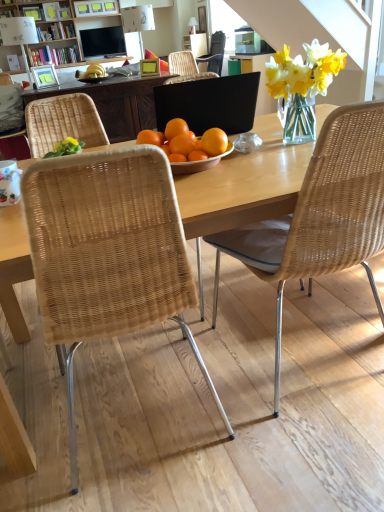
Image resolution: width=384 pixels, height=512 pixels. Identify the location of woven wicker chair at center, the 2th chair viewed from the back. (321, 214).

What do you see at coordinates (209, 103) in the screenshot?
I see `black matte laptop at center` at bounding box center [209, 103].

Locate an element on the screen. wooden table at center is located at coordinates (244, 185).

Image resolution: width=384 pixels, height=512 pixels. What do you see at coordinates (107, 252) in the screenshot?
I see `woven wicker chair at center, acting as the third chair starting from the back` at bounding box center [107, 252].

Measure the distance between point (x=16, y=106) and camera.

The distance of point (x=16, y=106) from camera is 4.02 meters.

Image resolution: width=384 pixels, height=512 pixels. Describe the element at coordinates (149, 67) in the screenshot. I see `matte green picture frame at upper center, positioned as the first picture frame in right-to-left order` at that location.

The height and width of the screenshot is (512, 384). I want to click on matte wood picture frame at upper left, which ranks as the second picture frame in right-to-left order, so click(x=44, y=76).

Considering the relative positions of wooden bookcase at upper center and woven wicker chair at center, the second chair positioned from the front, in the image provided, is wooden bookcase at upper center to the right of woven wicker chair at center, the second chair positioned from the front, from the viewer's perspective?

In fact, wooden bookcase at upper center is to the left of woven wicker chair at center, the second chair positioned from the front.

From the image's perspective, count 2nd chairs downward from the wooden bookcase at upper center and point to it. Please provide its 2D coordinates.

[(321, 214)]

Is point (83, 62) positioned before point (303, 251)?

No, (83, 62) is further to viewer.

Is woven wicker chair at center, positioned as the 2th chair in left-to-right order, at the back of black matte laptop at center?

black matte laptop at center does not have its back to woven wicker chair at center, positioned as the 2th chair in left-to-right order.

Considering the positions of objects black matte laptop at center and woven wicker chair at center, which ranks as the 2th chair in right-to-left order, in the image provided, who is more to the right, black matte laptop at center or woven wicker chair at center, which ranks as the 2th chair in right-to-left order,?

black matte laptop at center is more to the right.

Which of these two, black matte laptop at center or woven wicker chair at center, positioned as the 2th chair in left-to-right order, is bigger?

woven wicker chair at center, positioned as the 2th chair in left-to-right order.

Does point (211, 83) appear closer or farther from the camera than point (166, 215)?

Point (211, 83) is positioned farther from the camera compared to point (166, 215).

Consider the image. Is woven wicker chair at center, the second chair positioned from the front, oriented towards black matte laptop at center?

Yes, woven wicker chair at center, the second chair positioned from the front, is facing black matte laptop at center.

From their relative heights in the image, would you say woven wicker chair at center, arranged as the first chair when viewed from the right, is taller or shorter than black matte laptop at center?

Considering their sizes, woven wicker chair at center, arranged as the first chair when viewed from the right, has more height than black matte laptop at center.

Considering the sizes of objects woven wicker chair at center, the third chair from the left, and black matte laptop at center in the image provided, who is thinner, woven wicker chair at center, the third chair from the left, or black matte laptop at center?

With smaller width is black matte laptop at center.

Is black matte laptop at center touching wooden bookcase at upper center?

No, black matte laptop at center is not with wooden bookcase at upper center.

Who is taller, black matte laptop at center or wooden bookcase at upper center?

wooden bookcase at upper center is taller.

Is black matte laptop at center aimed at wooden bookcase at upper center?

Yes, black matte laptop at center is turned towards wooden bookcase at upper center.

Does black matte laptop at center have a lesser width compared to wooden bookcase at upper center?

Incorrect, the width of black matte laptop at center is not less than that of wooden bookcase at upper center.

Is black matte laptop at center inside or outside of wooden table at center?

black matte laptop at center is outside wooden table at center.

Does black matte laptop at center appear on the left side of wooden table at center?

Correct, you'll find black matte laptop at center to the left of wooden table at center.

This screenshot has width=384, height=512. I want to click on desk that appears in front of the black matte laptop at center, so click(x=244, y=185).

Considering the sizes of objects black matte laptop at center and wooden table at center in the image provided, who is taller, black matte laptop at center or wooden table at center?

Standing taller between the two is wooden table at center.

The height and width of the screenshot is (512, 384). Identify the location of chair that is the 3rd one when counting forward from the matte green picture frame at upper center, positioned as the first picture frame in right-to-left order. (107, 252).

Would you consider matte green picture frame at upper center, the 2th picture frame positioned from the left, to be distant from woven wicker chair at center, which ranks as the 2th chair in right-to-left order?

Yes, matte green picture frame at upper center, the 2th picture frame positioned from the left, is far from woven wicker chair at center, which ranks as the 2th chair in right-to-left order.

From a real-world perspective, is matte green picture frame at upper center, the 2th picture frame positioned from the left, located higher than woven wicker chair at center, which ranks as the 2th chair in right-to-left order?

Yes.

Between point (141, 68) and point (71, 332), which one is positioned behind?

The point (141, 68) is behind.

Considering the relative sizes of wooden bookcase at upper center and woven wicker chair at center, acting as the third chair starting from the back, in the image provided, is wooden bookcase at upper center shorter than woven wicker chair at center, acting as the third chair starting from the back,?

In fact, wooden bookcase at upper center may be taller than woven wicker chair at center, acting as the third chair starting from the back.

From the image's perspective, is wooden bookcase at upper center over woven wicker chair at center, which appears as the 1th chair when viewed from the front?

Yes, from the image's perspective, wooden bookcase at upper center is over woven wicker chair at center, which appears as the 1th chair when viewed from the front.

Between wooden bookcase at upper center and woven wicker chair at center, which ranks as the 2th chair in right-to-left order, which one has smaller size?

With smaller size is woven wicker chair at center, which ranks as the 2th chair in right-to-left order.

Based on their positions, is wooden bookcase at upper center located to the left or right of woven wicker chair at center, acting as the third chair starting from the back?

From the image, it's evident that wooden bookcase at upper center is to the left of woven wicker chair at center, acting as the third chair starting from the back.

Locate an element on the screen. This screenshot has width=384, height=512. bookcase positioned vertically above the woven wicker chair at center, the second chair positioned from the front (from a real-world perspective) is located at coordinates (54, 32).

Where is `chair that is the 3rd object directly below the black matte laptop at center (from a real-world perspective)`? The width and height of the screenshot is (384, 512). chair that is the 3rd object directly below the black matte laptop at center (from a real-world perspective) is located at coordinates (107, 252).

Estimate the real-world distances between objects in this image. Which object is further from woven wicker chair at center, the second chair positioned from the front, matte black television at upper center or wooden table at center?

matte black television at upper center is positioned further to the anchor woven wicker chair at center, the second chair positioned from the front.

Which object lies nearer to the anchor point woven wicker chair at center, positioned as the 2th chair in left-to-right order, matte green picture frame at upper center, the 2th picture frame positioned from the left, or wooden bookcase at upper center?

matte green picture frame at upper center, the 2th picture frame positioned from the left, is positioned closer to the anchor woven wicker chair at center, positioned as the 2th chair in left-to-right order.

When comparing their distances from matte wood picture frame at upper left, which is the first picture frame from left to right, does matte green picture frame at upper center, positioned as the first picture frame in right-to-left order, or wooden bookcase at upper center seem closer?

The object closer to matte wood picture frame at upper left, which is the first picture frame from left to right, is matte green picture frame at upper center, positioned as the first picture frame in right-to-left order.

From the image, which object appears to be farther from matte black television at upper center, woven rattan chair at left, the first chair when ordered from left to right, or matte green picture frame at upper center, the 2th picture frame positioned from the left?

woven rattan chair at left, the first chair when ordered from left to right, is positioned further to the anchor matte black television at upper center.

Considering their positions, is matte black television at upper center positioned closer to woven wicker chair at center, the second chair positioned from the front, than woven wicker chair at center, which ranks as the 2th chair in right-to-left order?

woven wicker chair at center, which ranks as the 2th chair in right-to-left order, lies closer to woven wicker chair at center, the second chair positioned from the front, than the other object.

When comparing their distances from matte wood picture frame at upper left, which is the first picture frame from left to right, does woven wicker chair at center, which appears as the 1th chair when viewed from the front, or wooden table at center seem further?

woven wicker chair at center, which appears as the 1th chair when viewed from the front, is positioned further to the anchor matte wood picture frame at upper left, which is the first picture frame from left to right.

Estimate the real-world distances between objects in this image. Which object is closer to matte wood picture frame at upper left, which ranks as the second picture frame in right-to-left order, matte green picture frame at upper center, the 2th picture frame positioned from the left, or woven rattan chair at left, positioned as the third chair in front-to-back order?

woven rattan chair at left, positioned as the third chair in front-to-back order.

When comparing their distances from woven rattan chair at left, positioned as the third chair in front-to-back order, does woven wicker chair at center, the second chair positioned from the front, or matte green picture frame at upper center, positioned as the first picture frame in right-to-left order, seem closer?

Among the two, matte green picture frame at upper center, positioned as the first picture frame in right-to-left order, is located nearer to woven rattan chair at left, positioned as the third chair in front-to-back order.

Locate an element on the screen. The image size is (384, 512). picture frame between wooden table at center and matte green picture frame at upper center, the 2th picture frame positioned from the left, in the front-back direction is located at coordinates (44, 76).

At what (x,y) coordinates should I click in order to perform the action: click on chair located between woven wicker chair at center, the 2th chair viewed from the back, and matte green picture frame at upper center, the 2th picture frame positioned from the left, in the depth direction. Please return your answer as a coordinate pair (x, y). This screenshot has height=512, width=384. Looking at the image, I should click on (12, 121).

The width and height of the screenshot is (384, 512). Identify the location of chair between woven wicker chair at center, arranged as the first chair when viewed from the right, and matte black television at upper center from front to back. 12,121.

Find the location of `laptop between woven wicker chair at center, positioned as the 2th chair in left-to-right order, and woven rattan chair at left, positioned as the third chair in front-to-back order, from front to back`. laptop between woven wicker chair at center, positioned as the 2th chair in left-to-right order, and woven rattan chair at left, positioned as the third chair in front-to-back order, from front to back is located at coordinates (209, 103).